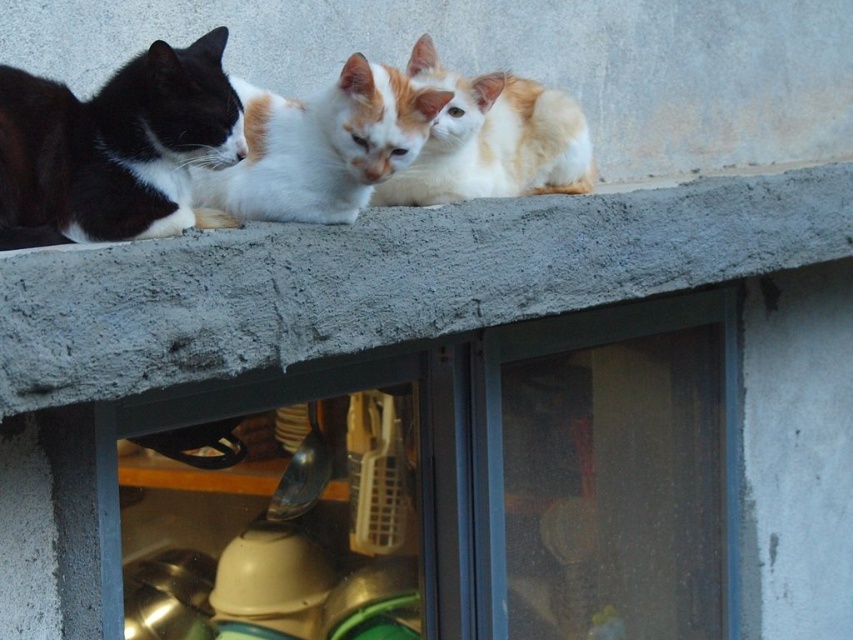
Is point (135, 248) positioned in front of point (48, 88)?

Yes, point (135, 248) is closer to viewer.

Can you confirm if concrete ledge at upper center is positioned to the right of black and white fur cat at left?

Correct, you'll find concrete ledge at upper center to the right of black and white fur cat at left.

Locate an element on the screen. The image size is (853, 640). concrete ledge at upper center is located at coordinates (386, 280).

Is concrete ledge at upper center thinner than white fur cat at center?

Incorrect, concrete ledge at upper center's width is not less than white fur cat at center's.

Which of these two, concrete ledge at upper center or white fur cat at center, stands taller?

With more height is concrete ledge at upper center.

Which is in front, point (292, 340) or point (270, 140)?

Point (292, 340)

Locate an element on the screen. concrete ledge at upper center is located at coordinates (386, 280).

Which is below, transparent plastic window at center or orange and white fur at upper center?

transparent plastic window at center

Who is positioned more to the left, transparent plastic window at center or orange and white fur at upper center?

orange and white fur at upper center

Locate an element on the screen. transparent plastic window at center is located at coordinates [613, 468].